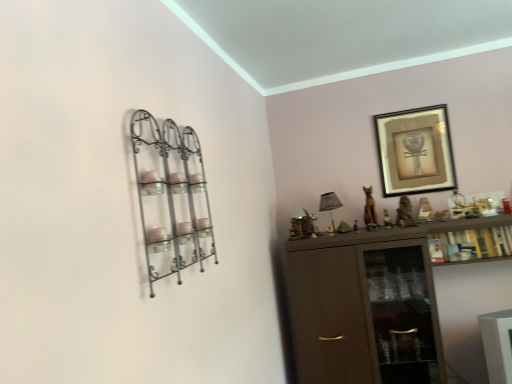
Question: Is satin gray fabric lampshade at upper center to the left or to the right of wooden cabinet at right in the image?

Choices:
 (A) left
 (B) right

Answer: (A)

Question: From their relative heights in the image, would you say satin gray fabric lampshade at upper center is taller or shorter than wooden cabinet at right?

Choices:
 (A) short
 (B) tall

Answer: (B)

Question: Considering the real-world distances, which object is closest to the gold-framed artwork at upper right?

Choices:
 (A) satin gray fabric lampshade at upper center
 (B) wooden cabinet at right
 (C) metallic wire shelf at left

Answer: (B)

Question: Which of these objects is positioned farthest from the gold-framed artwork at upper right?

Choices:
 (A) wooden cabinet at right
 (B) satin gray fabric lampshade at upper center
 (C) metallic wire shelf at left

Answer: (C)